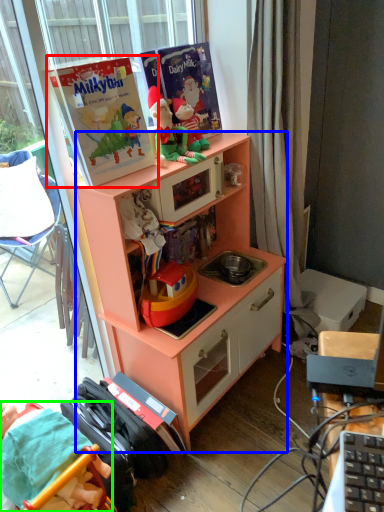
Question: Based on their relative distances, which object is farther from paperback book (highlighted by a red box)? Choose from cabinetry (highlighted by a blue box) and person (highlighted by a green box).

Choices:
 (A) cabinetry
 (B) person

Answer: (B)